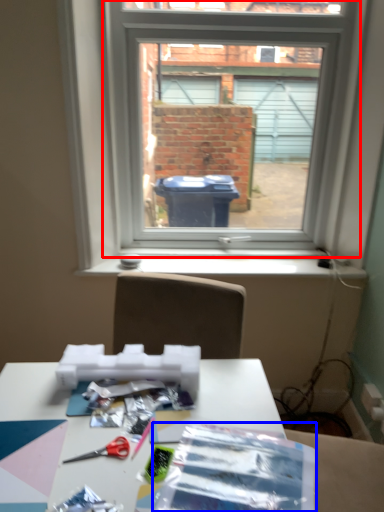
Question: Which of the following is the farthest to the observer, window (highlighted by a red box) or wrapping paper (highlighted by a blue box)?

Choices:
 (A) window
 (B) wrapping paper

Answer: (A)